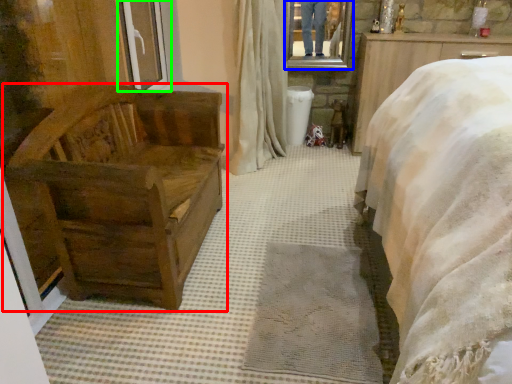
Question: Which object is the farthest from furniture (highlighted by a red box)? Choose among these: mirror (highlighted by a blue box) or window frame (highlighted by a green box).

Choices:
 (A) mirror
 (B) window frame

Answer: (A)